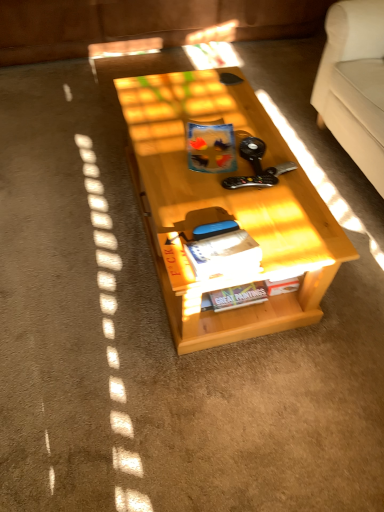
This screenshot has height=512, width=384. What do you see at coordinates (224, 255) in the screenshot?
I see `matte paper magazine at center` at bounding box center [224, 255].

Looking at this image, measure the distance between light wood table at center and camera.

1.24 meters.

What are the coordinates of `hardcover book at center, marked as the 3th book in a front-to-back arrangement` in the screenshot? It's located at coord(247,294).

This screenshot has height=512, width=384. What do you see at coordinates (209, 252) in the screenshot?
I see `hardcover book at center, marked as the 3th book in a back-to-front arrangement` at bounding box center [209, 252].

Identify the location of matte paper magazine at center. (224, 255).

How many degrees apart are the facing directions of light wood table at center and hardcover book at center, which appears as the first book when viewed from the front?

The facing directions of light wood table at center and hardcover book at center, which appears as the first book when viewed from the front, are 180 degrees apart.

Is light wood table at center next to hardcover book at center, which is the second book from bottom to top?

No, light wood table at center is not in contact with hardcover book at center, which is the second book from bottom to top.

Is hardcover book at center, marked as the 3th book in a back-to-front arrangement, inside light wood table at center?

No, hardcover book at center, marked as the 3th book in a back-to-front arrangement, is not a part of light wood table at center.

Looking at this image, from a real-world perspective, is light wood table at center physically located above or below hardcover book at center, marked as the 3th book in a back-to-front arrangement?

Clearly, from a real-world perspective, light wood table at center is below hardcover book at center, marked as the 3th book in a back-to-front arrangement.

Choose the correct answer: Is matte plastic book at center, which ranks as the 1th book in top-to-bottom order, inside light wood table at center or outside it?

The correct answer is: inside.

In the image, there is a light wood table at center. At what (x,y) coordinates should I click in order to perform the action: click on book above it (from the image's perspective). Please return your answer as a coordinate pair (x, y). Looking at the image, I should click on (211, 147).

Which of these two, matte plastic book at center, placed as the 3th book when sorted from bottom to top, or light wood table at center, is bigger?

light wood table at center.

Is matte plastic book at center, placed as the 3th book when sorted from bottom to top, facing away from light wood table at center?

No.

Is matte plastic book at center, placed as the 3th book when sorted from bottom to top, located within light wood table at center?

Indeed, matte plastic book at center, placed as the 3th book when sorted from bottom to top, is located within light wood table at center.

Is light wood table at center oriented towards matte plastic book at center, which ranks as the second book in front-to-back order?

No, light wood table at center is not facing towards matte plastic book at center, which ranks as the second book in front-to-back order.

Considering the positions of point (288, 197) and point (225, 132), is point (288, 197) closer or farther from the camera than point (225, 132)?

Point (288, 197) is positioned closer to the camera compared to point (225, 132).

Is matte plastic book at center, which ranks as the 1th book in top-to-bottom order, facing towards hardcover book at center, which appears as the first book when viewed from the front?

No, matte plastic book at center, which ranks as the 1th book in top-to-bottom order, does not turn towards hardcover book at center, which appears as the first book when viewed from the front.

Between matte plastic book at center, which is the second book in back-to-front order, and hardcover book at center, marked as the 3th book in a back-to-front arrangement, which one has smaller size?

hardcover book at center, marked as the 3th book in a back-to-front arrangement.

Is matte plastic book at center, which is the second book in back-to-front order, shorter than hardcover book at center, which appears as the first book when viewed from the front?

Answer: No.

How many degrees apart are the facing directions of light wood table at center and matte paper magazine at center?

The angle between the facing direction of light wood table at center and the facing direction of matte paper magazine at center is 180 degrees.

Does light wood table at center lie behind matte paper magazine at center?

Yes, light wood table at center is further from the camera.

Locate an element on the screen. table lying on the left of matte paper magazine at center is located at coordinates (224, 207).

From the image's perspective, relative to matte paper magazine at center, is light wood table at center above or below?

From the image's perspective, light wood table at center appears above matte paper magazine at center.

In order to click on the 2nd book located beneath the matte paper magazine at center (from a real-world perspective) in this screenshot , I will do `click(211, 147)`.

What's the angular difference between matte paper magazine at center and matte plastic book at center, which ranks as the 1th book in top-to-bottom order,'s facing directions?

The angular difference between matte paper magazine at center and matte plastic book at center, which ranks as the 1th book in top-to-bottom order, is 81.3 degrees.

Does matte paper magazine at center touch matte plastic book at center, placed as the 3th book when sorted from bottom to top?

matte paper magazine at center and matte plastic book at center, placed as the 3th book when sorted from bottom to top, are clearly separated.

Who is taller, matte plastic book at center, which ranks as the 1th book in top-to-bottom order, or hardcover book at center, positioned as the 1th book in back-to-front order?

Standing taller between the two is matte plastic book at center, which ranks as the 1th book in top-to-bottom order.

Looking at this image, between matte plastic book at center, which ranks as the 1th book in top-to-bottom order, and hardcover book at center, positioned as the 1th book in back-to-front order, which one appears on the right side from the viewer's perspective?

hardcover book at center, positioned as the 1th book in back-to-front order, is more to the right.

Is matte plastic book at center, which ranks as the 1th book in top-to-bottom order, smaller than hardcover book at center, which is the first book in bottom-to-top order?

No, matte plastic book at center, which ranks as the 1th book in top-to-bottom order, is not smaller than hardcover book at center, which is the first book in bottom-to-top order.

From the image's perspective, which is below, matte plastic book at center, placed as the 3th book when sorted from bottom to top, or hardcover book at center, which is the 3th book in top-to-bottom order?

hardcover book at center, which is the 3th book in top-to-bottom order, appears lower in the image.

Where is `book in front of the light wood table at center`? book in front of the light wood table at center is located at coordinates (209, 252).

Locate an element on the screen. This screenshot has height=512, width=384. table lying below the matte plastic book at center, which ranks as the 1th book in top-to-bottom order (from the image's perspective) is located at coordinates click(x=224, y=207).

Looking at the image, which one is located further to light wood table at center, hardcover book at center, which appears as the first book when viewed from the front, or matte plastic book at center, placed as the 3th book when sorted from bottom to top?

matte plastic book at center, placed as the 3th book when sorted from bottom to top.

Which object lies further to the anchor point hardcover book at center, which is the 3th book in top-to-bottom order, hardcover book at center, which is the second book from bottom to top, or light wood table at center?

light wood table at center is positioned further to the anchor hardcover book at center, which is the 3th book in top-to-bottom order.

Looking at this image, considering their positions, is matte plastic book at center, which ranks as the second book in front-to-back order, positioned closer to hardcover book at center, marked as the 3th book in a back-to-front arrangement, than hardcover book at center, which is the first book in bottom-to-top order?

The object closer to hardcover book at center, marked as the 3th book in a back-to-front arrangement, is hardcover book at center, which is the first book in bottom-to-top order.

Looking at the image, which one is located further to light wood table at center, hardcover book at center, which appears as the 2th book when viewed from the top, or matte paper magazine at center?

matte paper magazine at center is positioned further to the anchor light wood table at center.

Based on their spatial positions, is matte paper magazine at center or hardcover book at center, marked as the 3th book in a front-to-back arrangement, further from light wood table at center?

Among the two, hardcover book at center, marked as the 3th book in a front-to-back arrangement, is located further to light wood table at center.

When comparing their distances from matte paper magazine at center, does matte plastic book at center, which ranks as the 1th book in top-to-bottom order, or light wood table at center seem further?

The object further to matte paper magazine at center is matte plastic book at center, which ranks as the 1th book in top-to-bottom order.

When comparing their distances from hardcover book at center, which appears as the first book when viewed from the front, does light wood table at center or hardcover book at center, which is the first book in bottom-to-top order, seem closer?

light wood table at center is positioned closer to the anchor hardcover book at center, which appears as the first book when viewed from the front.

Looking at the image, which one is located closer to light wood table at center, matte plastic book at center, placed as the 3th book when sorted from bottom to top, or hardcover book at center, marked as the 3th book in a front-to-back arrangement?

Based on the image, matte plastic book at center, placed as the 3th book when sorted from bottom to top, appears to be nearer to light wood table at center.

Identify the location of magazine between matte plastic book at center, placed as the 3th book when sorted from bottom to top, and hardcover book at center, which is the 3th book in top-to-bottom order, in the up-down direction. The image size is (384, 512). (224, 255).

Where is `table that lies between matte plastic book at center, which ranks as the second book in front-to-back order, and matte paper magazine at center from top to bottom`? table that lies between matte plastic book at center, which ranks as the second book in front-to-back order, and matte paper magazine at center from top to bottom is located at coordinates (224, 207).

Image resolution: width=384 pixels, height=512 pixels. I want to click on magazine between matte plastic book at center, which ranks as the 1th book in top-to-bottom order, and hardcover book at center, which appears as the 2th book when viewed from the top, vertically, so click(x=224, y=255).

Where is `book between matte plastic book at center, which ranks as the second book in front-to-back order, and hardcover book at center, positioned as the 1th book in back-to-front order, in the up-down direction`? Image resolution: width=384 pixels, height=512 pixels. book between matte plastic book at center, which ranks as the second book in front-to-back order, and hardcover book at center, positioned as the 1th book in back-to-front order, in the up-down direction is located at coordinates (209, 252).